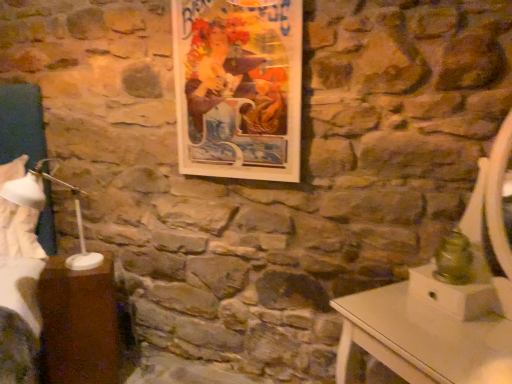
Locate an element on the screen. The width and height of the screenshot is (512, 384). white plastic bedside lamp at left is located at coordinates (23, 212).

Locate an element on the screen. Image resolution: width=512 pixels, height=384 pixels. white fabric at left is located at coordinates (20, 248).

Is brown wood table at lower left thinner than white plastic bedside lamp at left?

Correct, the width of brown wood table at lower left is less than that of white plastic bedside lamp at left.

Can you confirm if brown wood table at lower left is bigger than white plastic bedside lamp at left?

No.

The width and height of the screenshot is (512, 384). What are the coordinates of `table behind the white plastic bedside lamp at left` in the screenshot? It's located at (79, 324).

Looking at this image, from their relative heights in the image, would you say brown wood table at lower left is taller or shorter than white plastic bedside lamp at left?

In the image, brown wood table at lower left appears to be taller than white plastic bedside lamp at left.

From the image's perspective, between brown wood table at lower left and wooden picture frame at upper center, which one is located above?

wooden picture frame at upper center is shown above in the image.

Which is correct: brown wood table at lower left is inside wooden picture frame at upper center, or outside of it?

brown wood table at lower left lies outside wooden picture frame at upper center.

Considering the sizes of objects white plastic bedside lamp at left and brown wood table at lower left in the image provided, who is shorter, white plastic bedside lamp at left or brown wood table at lower left?

white plastic bedside lamp at left.

Is white plastic bedside lamp at left next to brown wood table at lower left and touching it?

No, white plastic bedside lamp at left is not touching brown wood table at lower left.

The height and width of the screenshot is (384, 512). Find the location of `bedside lamp located above the brown wood table at lower left (from the image's perspective)`. bedside lamp located above the brown wood table at lower left (from the image's perspective) is located at coordinates (23, 212).

Looking at this image, is white fabric at left next to white plastic bedside lamp at left and touching it?

Yes, white fabric at left and white plastic bedside lamp at left clearly make contact.

Between white fabric at left and white plastic bedside lamp at left, which one has smaller size?

With smaller size is white plastic bedside lamp at left.

From a real-world perspective, is white fabric at left physically located above or below white plastic bedside lamp at left?

From a real-world perspective, white fabric at left is physically below white plastic bedside lamp at left.

Which point is more distant from viewer, (6, 294) or (40, 252)?

The point (40, 252) is more distant.

Considering the relative positions of wooden picture frame at upper center and white fabric at left in the image provided, is wooden picture frame at upper center to the right of white fabric at left from the viewer's perspective?

Indeed, wooden picture frame at upper center is positioned on the right side of white fabric at left.

From the image's perspective, would you say wooden picture frame at upper center is shown under white fabric at left?

Actually, wooden picture frame at upper center appears above white fabric at left in the image.

Is wooden picture frame at upper center oriented towards white fabric at left?

No, wooden picture frame at upper center is not aimed at white fabric at left.

How far apart are white fabric at left and wooden picture frame at upper center?

They are 1.15 meters apart.

Does white fabric at left turn towards wooden picture frame at upper center?

No, white fabric at left does not turn towards wooden picture frame at upper center.

Which of these two, white fabric at left or wooden picture frame at upper center, stands shorter?

wooden picture frame at upper center.

Which point is more distant from viewer, (13, 276) or (298, 82)?

The point (13, 276) is behind.

From the image's perspective, is white plastic bedside lamp at left below white fabric at left?

Yes.

Considering the sizes of white plastic bedside lamp at left and white fabric at left in the image, is white plastic bedside lamp at left wider or thinner than white fabric at left?

Considering their sizes, white plastic bedside lamp at left looks slimmer than white fabric at left.

From a real-world perspective, which object rests below the other?

From a 3D spatial view, white fabric at left is below.

At what (x,y) coordinates should I click in order to perform the action: click on bedside lamp in front of the brown wood table at lower left. Please return your answer as a coordinate pair (x, y). This screenshot has height=384, width=512. Looking at the image, I should click on (23, 212).

The image size is (512, 384). I want to click on picture frame above the brown wood table at lower left (from a real-world perspective), so click(238, 87).

Which object lies nearer to the anchor point white fabric at left, brown wood table at lower left or wooden picture frame at upper center?

Among the two, brown wood table at lower left is located nearer to white fabric at left.

Based on their spatial positions, is white plastic bedside lamp at left or wooden picture frame at upper center further from brown wood table at lower left?

wooden picture frame at upper center is further to brown wood table at lower left.

Which object lies nearer to the anchor point wooden picture frame at upper center, white plastic bedside lamp at left or brown wood table at lower left?

white plastic bedside lamp at left.

Looking at the image, which one is located further to white plastic bedside lamp at left, white fabric at left or brown wood table at lower left?

The object further to white plastic bedside lamp at left is brown wood table at lower left.

Which object lies further to the anchor point wooden picture frame at upper center, brown wood table at lower left or white fabric at left?

Among the two, white fabric at left is located further to wooden picture frame at upper center.

Looking at the image, which one is located closer to white plastic bedside lamp at left, wooden picture frame at upper center or brown wood table at lower left?

brown wood table at lower left lies closer to white plastic bedside lamp at left than the other object.

Estimate the real-world distances between objects in this image. Which object is further from brown wood table at lower left, white fabric at left or white plastic bedside lamp at left?

white plastic bedside lamp at left is further to brown wood table at lower left.

Based on their spatial positions, is white plastic bedside lamp at left or white fabric at left closer to brown wood table at lower left?

white fabric at left lies closer to brown wood table at lower left than the other object.

Identify the location of bedside lamp between white fabric at left and brown wood table at lower left vertically. This screenshot has width=512, height=384. (23, 212).

Locate an element on the screen. The height and width of the screenshot is (384, 512). bedside lamp between white fabric at left and wooden picture frame at upper center from left to right is located at coordinates (23, 212).

At what (x,y) coordinates should I click in order to perform the action: click on table located between white fabric at left and wooden picture frame at upper center in the left-right direction. Please return your answer as a coordinate pair (x, y). This screenshot has height=384, width=512. Looking at the image, I should click on (79, 324).

Where is `bedside lamp between wooden picture frame at upper center and brown wood table at lower left vertically`? The width and height of the screenshot is (512, 384). bedside lamp between wooden picture frame at upper center and brown wood table at lower left vertically is located at coordinates (23, 212).